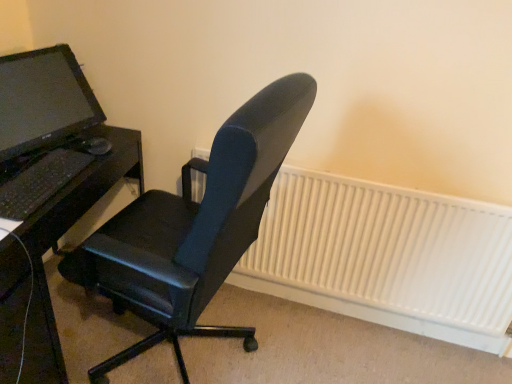
Question: From a real-world perspective, is black matte desk at left below black matte keyboard at left?

Choices:
 (A) yes
 (B) no

Answer: (A)

Question: Is black matte desk at left at the right side of black matte keyboard at left?

Choices:
 (A) yes
 (B) no

Answer: (B)

Question: Can you confirm if black matte desk at left is smaller than black matte keyboard at left?

Choices:
 (A) yes
 (B) no

Answer: (B)

Question: Is black matte desk at left completely or partially outside of black matte keyboard at left?

Choices:
 (A) yes
 (B) no

Answer: (A)

Question: From the image's perspective, is black matte desk at left located above black matte keyboard at left?

Choices:
 (A) yes
 (B) no

Answer: (B)

Question: Considering the relative sizes of black matte desk at left and black matte keyboard at left in the image provided, is black matte desk at left thinner than black matte keyboard at left?

Choices:
 (A) no
 (B) yes

Answer: (A)

Question: Is black leather office chair at center completely or partially inside matte black monitor at left?

Choices:
 (A) no
 (B) yes

Answer: (A)

Question: From the image's perspective, is matte black monitor at left on top of black leather office chair at center?

Choices:
 (A) no
 (B) yes

Answer: (B)

Question: Are matte black monitor at left and black leather office chair at center making contact?

Choices:
 (A) yes
 (B) no

Answer: (B)

Question: Does matte black monitor at left have a greater height compared to black leather office chair at center?

Choices:
 (A) yes
 (B) no

Answer: (B)

Question: Would you consider matte black monitor at left to be distant from black leather office chair at center?

Choices:
 (A) no
 (B) yes

Answer: (A)

Question: Is matte black monitor at left outside black leather office chair at center?

Choices:
 (A) yes
 (B) no

Answer: (A)

Question: From a real-world perspective, does black matte keyboard at left sit lower than white matte radiator at center?

Choices:
 (A) yes
 (B) no

Answer: (B)